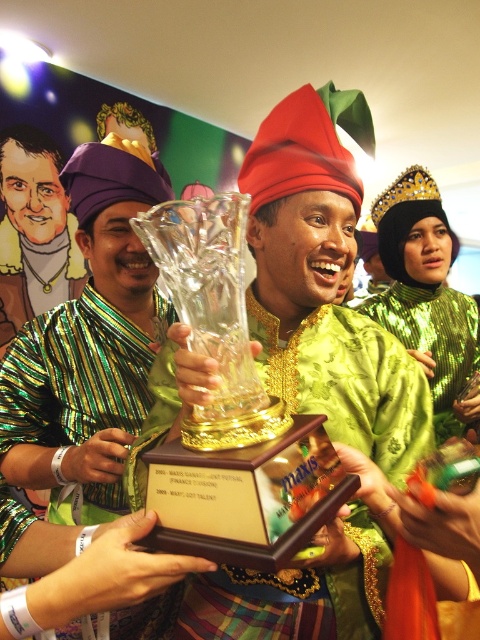
Question: Which object is farther from the camera taking this photo?

Choices:
 (A) translucent glass trophy at center
 (B) green striped shirt at center
 (C) clear glass trophy at center

Answer: (B)

Question: Is clear glass trophy at center wider than green striped shirt at center?

Choices:
 (A) no
 (B) yes

Answer: (A)

Question: Is clear glass trophy at center bigger than green sequined dress at center?

Choices:
 (A) yes
 (B) no

Answer: (B)

Question: Which point appears closest to the camera in this image?

Choices:
 (A) (348, 602)
 (B) (172, 220)

Answer: (B)

Question: Which of these objects is positioned closest to the translucent glass trophy at center?

Choices:
 (A) green striped shirt at center
 (B) clear glass trophy at center

Answer: (B)

Question: Can you confirm if green sequined dress at center is positioned to the left of green striped shirt at center?

Choices:
 (A) yes
 (B) no

Answer: (B)